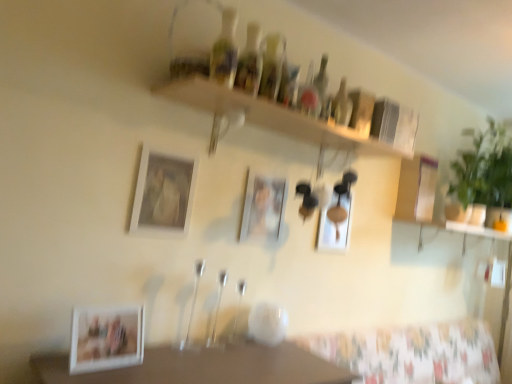
Question: Are matte white picture frame at upper center, the third picture frame positioned from the back, and matte white picture frame at center, which is counted as the first picture frame, starting from the back, making contact?

Choices:
 (A) no
 (B) yes

Answer: (A)

Question: Can you confirm if matte white picture frame at upper center, positioned as the second picture frame in left-to-right order, is smaller than matte white picture frame at center, which appears as the 4th picture frame when viewed from the front?

Choices:
 (A) yes
 (B) no

Answer: (A)

Question: From a real-world perspective, is matte white picture frame at upper center, marked as the third picture frame in a right-to-left arrangement, located beneath matte white picture frame at center, the fourth picture frame viewed from the left?

Choices:
 (A) yes
 (B) no

Answer: (B)

Question: From the image's perspective, is matte white picture frame at upper center, the third picture frame positioned from the back, on top of matte white picture frame at center, which appears as the 4th picture frame when viewed from the front?

Choices:
 (A) no
 (B) yes

Answer: (B)

Question: Is matte white picture frame at upper center, positioned as the second picture frame in left-to-right order, wider than matte white picture frame at center, the first picture frame from the right?

Choices:
 (A) yes
 (B) no

Answer: (B)

Question: Relative to translucent glass bottles at upper center, placed as the 2th bottle when sorted from front to back, is translucent glass bottles at upper center, which is the third bottle from front to back, in front or behind?

Choices:
 (A) behind
 (B) front

Answer: (A)

Question: Do you think translucent glass bottles at upper center, which is the third bottle from left to right, is within translucent glass bottles at upper center, marked as the fourth bottle in a right-to-left arrangement, or outside of it?

Choices:
 (A) outside
 (B) inside

Answer: (A)

Question: From a real-world perspective, is translucent glass bottles at upper center, which is the third bottle from back to front, above or below translucent glass bottles at upper center, acting as the fourth bottle starting from the back?

Choices:
 (A) below
 (B) above

Answer: (A)

Question: Considering the positions of translucent glass bottles at upper center, which is the third bottle from front to back, and translucent glass bottles at upper center, placed as the 2th bottle when sorted from front to back, in the image, is translucent glass bottles at upper center, which is the third bottle from front to back, wider or thinner than translucent glass bottles at upper center, placed as the 2th bottle when sorted from front to back,?

Choices:
 (A) thin
 (B) wide

Answer: (B)

Question: From a real-world perspective, is translucent glass bottles at upper center, which is the third bottle from back to front, positioned above or below translucent glass bottles at upper center, which is counted as the fifth bottle, starting from the back?

Choices:
 (A) above
 (B) below

Answer: (B)

Question: In terms of size, does translucent glass bottles at upper center, which is the third bottle from front to back, appear bigger or smaller than translucent glass bottles at upper center, which is counted as the fifth bottle, starting from the back?

Choices:
 (A) small
 (B) big

Answer: (B)

Question: Is translucent glass bottles at upper center, which is the third bottle from back to front, wider or thinner than translucent glass bottles at upper center, arranged as the 1th bottle when viewed from the front?

Choices:
 (A) wide
 (B) thin

Answer: (A)

Question: Is translucent glass bottles at upper center, which is the third bottle from front to back, taller or shorter than translucent glass bottles at upper center, arranged as the 1th bottle when viewed from the front?

Choices:
 (A) tall
 (B) short

Answer: (A)

Question: Considering the positions of green leafy plant at right and matte white picture frame at center, which appears as the 4th picture frame when viewed from the front, in the image, is green leafy plant at right bigger or smaller than matte white picture frame at center, which appears as the 4th picture frame when viewed from the front,?

Choices:
 (A) small
 (B) big

Answer: (B)

Question: Based on their positions, is green leafy plant at right located to the left or right of matte white picture frame at center, which appears as the 4th picture frame when viewed from the front?

Choices:
 (A) right
 (B) left

Answer: (A)